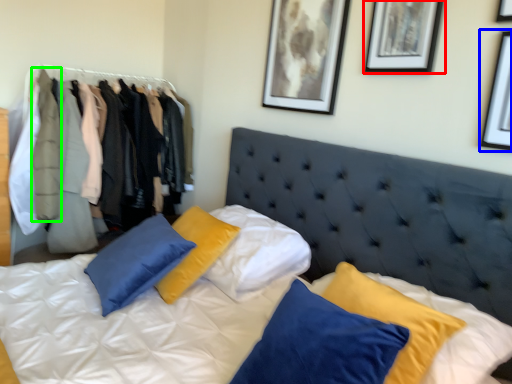
Question: Which object is the closest to the picture frame (highlighted by a red box)? Choose among these: picture frame (highlighted by a blue box) or clothing (highlighted by a green box).

Choices:
 (A) picture frame
 (B) clothing

Answer: (A)